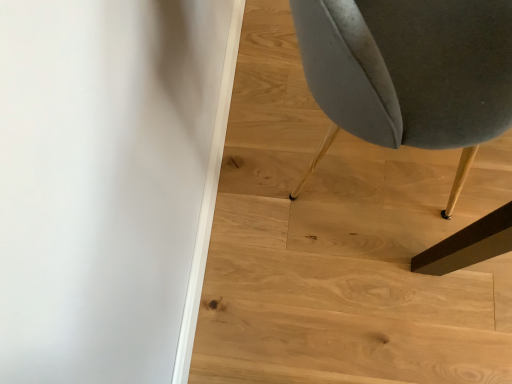
The height and width of the screenshot is (384, 512). Identify the location of vacant space situated on the left part of velvet grey chair at right. (252, 193).